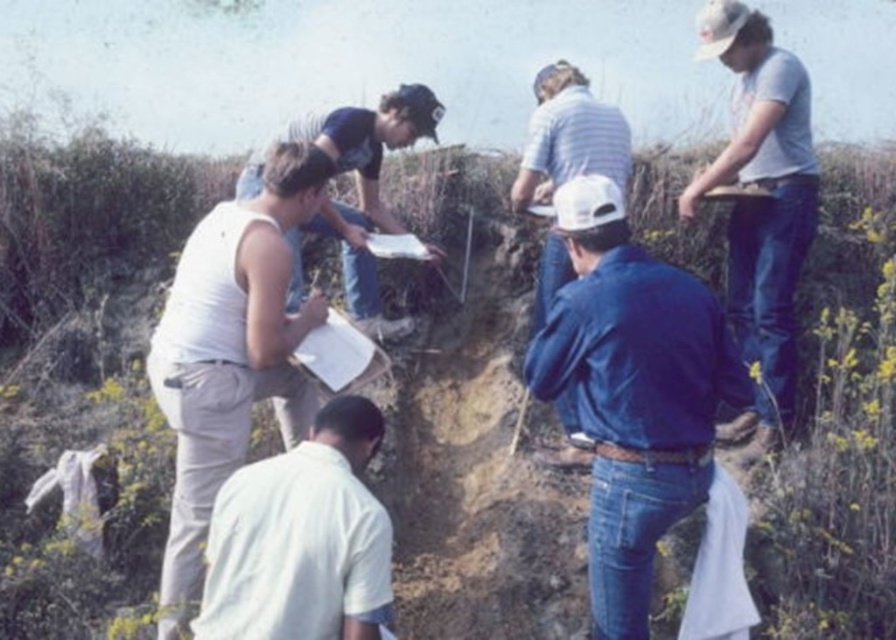
Question: Which point is closer to the camera?

Choices:
 (A) (177, 435)
 (B) (711, 348)
 (C) (290, 452)

Answer: (B)

Question: Does white cotton shirt at upper right appear on the right side of white paper at center?

Choices:
 (A) no
 (B) yes

Answer: (B)

Question: Can you confirm if blue denim jeans at center is smaller than white cotton shirt at lower center?

Choices:
 (A) no
 (B) yes

Answer: (A)

Question: Based on their relative distances, which object is farther from the white striped shirt at center?

Choices:
 (A) white cotton shirt at upper right
 (B) white cotton tank top at left

Answer: (B)

Question: Which is farther from the white paper at center?

Choices:
 (A) white cotton shirt at lower center
 (B) white striped shirt at center
 (C) blue denim jeans at center

Answer: (C)

Question: From the image, what is the correct spatial relationship of blue denim jeans at center in relation to white cotton shirt at upper right?

Choices:
 (A) left
 (B) right

Answer: (A)